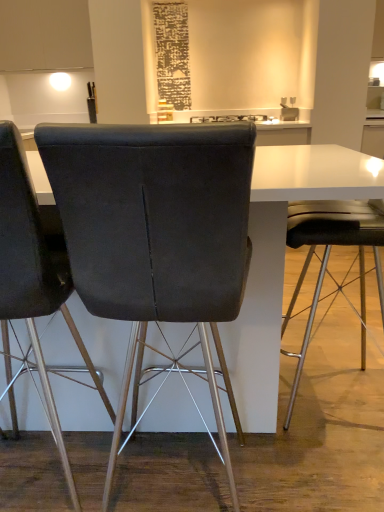
In order to face black glossy toaster at center, should I rotate leftwards or rightwards?

Turn right approximately 4.908 degrees to face it.

Identify the location of black glossy toaster at center. (233, 118).

This screenshot has height=512, width=384. Describe the element at coordinates (155, 230) in the screenshot. I see `dark gray fabric chair at center, which ranks as the 2th chair in left-to-right order` at that location.

Describe the element at coordinates (328, 258) in the screenshot. I see `matte black chair at right, positioned as the third chair in left-to-right order` at that location.

This screenshot has width=384, height=512. What are the coordinates of `matte white sink at upper center` in the screenshot? It's located at (289, 110).

Are dark gray fabric chair at center, which is the 2th chair in right-to-left order, and matte white sink at upper center located far from each other?

Yes, dark gray fabric chair at center, which is the 2th chair in right-to-left order, and matte white sink at upper center are quite far apart.

From the image's perspective, count 2nd chairs downward from the matte white sink at upper center and point to it. Please provide its 2D coordinates.

[(155, 230)]

Between dark gray fabric chair at center, which is the 2th chair in right-to-left order, and matte white sink at upper center, which one appears on the right side from the viewer's perspective?

Positioned to the right is matte white sink at upper center.

Looking at this image, is dark gray fabric chair at center, which is the 2th chair in right-to-left order, far away from velvet dark gray chair at left, acting as the 3th chair starting from the right?

No, dark gray fabric chair at center, which is the 2th chair in right-to-left order, is not far away from velvet dark gray chair at left, acting as the 3th chair starting from the right.

From a real-world perspective, does dark gray fabric chair at center, which is the 2th chair in right-to-left order, sit lower than velvet dark gray chair at left, the first chair positioned from the left?

Actually, dark gray fabric chair at center, which is the 2th chair in right-to-left order, is physically above velvet dark gray chair at left, the first chair positioned from the left, in the real world.

Considering the relative sizes of dark gray fabric chair at center, which ranks as the 2th chair in left-to-right order, and velvet dark gray chair at left, acting as the 3th chair starting from the right, in the image provided, is dark gray fabric chair at center, which ranks as the 2th chair in left-to-right order, shorter than velvet dark gray chair at left, acting as the 3th chair starting from the right,?

Correct, dark gray fabric chair at center, which ranks as the 2th chair in left-to-right order, is not as tall as velvet dark gray chair at left, acting as the 3th chair starting from the right.

Where is `chair located in front of the velvet dark gray chair at left, the first chair positioned from the left`? The height and width of the screenshot is (512, 384). chair located in front of the velvet dark gray chair at left, the first chair positioned from the left is located at coordinates (155, 230).

Is dark gray fabric chair at center, which is the 2th chair in right-to-left order, turned away from black glossy toaster at center?

No, dark gray fabric chair at center, which is the 2th chair in right-to-left order,'s orientation is not away from black glossy toaster at center.

Is point (200, 296) behind point (260, 116)?

No.

From the image's perspective, is dark gray fabric chair at center, which ranks as the 2th chair in left-to-right order, beneath black glossy toaster at center?

Yes, from the image's perspective, dark gray fabric chair at center, which ranks as the 2th chair in left-to-right order, is beneath black glossy toaster at center.

Does velvet dark gray chair at left, acting as the 3th chair starting from the right, appear on the left side of dark gray fabric chair at center, which ranks as the 2th chair in left-to-right order?

Correct, you'll find velvet dark gray chair at left, acting as the 3th chair starting from the right, to the left of dark gray fabric chair at center, which ranks as the 2th chair in left-to-right order.

Is velvet dark gray chair at left, the first chair positioned from the left, facing towards dark gray fabric chair at center, which ranks as the 2th chair in left-to-right order?

No, velvet dark gray chair at left, the first chair positioned from the left, is not turned towards dark gray fabric chair at center, which ranks as the 2th chair in left-to-right order.

From the image's perspective, is velvet dark gray chair at left, acting as the 3th chair starting from the right, beneath dark gray fabric chair at center, which is the 2th chair in right-to-left order?

Indeed, from the image's perspective, velvet dark gray chair at left, acting as the 3th chair starting from the right, is shown beneath dark gray fabric chair at center, which is the 2th chair in right-to-left order.

How many degrees apart are the facing directions of velvet dark gray chair at left, the first chair positioned from the left, and dark gray fabric chair at center, which ranks as the 2th chair in left-to-right order?

They differ by 0.364 degrees in their facing directions.

Between matte white sink at upper center and dark gray fabric chair at center, which ranks as the 2th chair in left-to-right order, which one has smaller size?

With smaller size is matte white sink at upper center.

Between matte white sink at upper center and dark gray fabric chair at center, which is the 2th chair in right-to-left order, which one has less height?

matte white sink at upper center.

In terms of width, does matte white sink at upper center look wider or thinner when compared to dark gray fabric chair at center, which ranks as the 2th chair in left-to-right order?

Clearly, matte white sink at upper center has less width compared to dark gray fabric chair at center, which ranks as the 2th chair in left-to-right order.

Is matte white sink at upper center to the right of matte black chair at right, positioned as the third chair in left-to-right order, from the viewer's perspective?

Yes, matte white sink at upper center is to the right of matte black chair at right, positioned as the third chair in left-to-right order.

From the image's perspective, is matte white sink at upper center under matte black chair at right, positioned as the third chair in left-to-right order?

Incorrect, from the image's perspective, matte white sink at upper center is higher than matte black chair at right, positioned as the third chair in left-to-right order.

From a real-world perspective, which object stands above the other?

matte white sink at upper center.

This screenshot has width=384, height=512. Identify the location of sink to the right of velvet dark gray chair at left, the first chair positioned from the left. (289, 110).

Does matte white sink at upper center contain velvet dark gray chair at left, the first chair positioned from the left?

No.

From the image's perspective, which one is positioned lower, matte white sink at upper center or velvet dark gray chair at left, the first chair positioned from the left?

velvet dark gray chair at left, the first chair positioned from the left, appears lower in the image.

From the image's perspective, which chair is the 2nd one below the matte white sink at upper center? Please provide its 2D coordinates.

[(155, 230)]

Where is `chair in front of the velvet dark gray chair at left, the first chair positioned from the left`? The width and height of the screenshot is (384, 512). chair in front of the velvet dark gray chair at left, the first chair positioned from the left is located at coordinates (155, 230).

From the picture: Looking at the image, which one is located closer to velvet dark gray chair at left, the first chair positioned from the left, black glossy toaster at center or dark gray fabric chair at center, which ranks as the 2th chair in left-to-right order?

dark gray fabric chair at center, which ranks as the 2th chair in left-to-right order, lies closer to velvet dark gray chair at left, the first chair positioned from the left, than the other object.

From the picture: Looking at the image, which one is located further to matte white sink at upper center, matte black chair at right, positioned as the third chair in left-to-right order, or dark gray fabric chair at center, which is the 2th chair in right-to-left order?

Among the two, dark gray fabric chair at center, which is the 2th chair in right-to-left order, is located further to matte white sink at upper center.

From the image, which object appears to be nearer to black glossy toaster at center, dark gray fabric chair at center, which ranks as the 2th chair in left-to-right order, or velvet dark gray chair at left, the first chair positioned from the left?

velvet dark gray chair at left, the first chair positioned from the left, is positioned closer to the anchor black glossy toaster at center.

Which object lies nearer to the anchor point velvet dark gray chair at left, the first chair positioned from the left, matte black chair at right, positioned as the third chair in left-to-right order, or black glossy toaster at center?

matte black chair at right, positioned as the third chair in left-to-right order, lies closer to velvet dark gray chair at left, the first chair positioned from the left, than the other object.

Considering their positions, is black glossy toaster at center positioned further to dark gray fabric chair at center, which is the 2th chair in right-to-left order, than velvet dark gray chair at left, acting as the 3th chair starting from the right?

black glossy toaster at center.

Based on their spatial positions, is velvet dark gray chair at left, the first chair positioned from the left, or matte white sink at upper center further from dark gray fabric chair at center, which ranks as the 2th chair in left-to-right order?

matte white sink at upper center.

Looking at the image, which one is located closer to matte black chair at right, the 1th chair positioned from the right, matte white sink at upper center or velvet dark gray chair at left, acting as the 3th chair starting from the right?

Based on the image, velvet dark gray chair at left, acting as the 3th chair starting from the right, appears to be nearer to matte black chair at right, the 1th chair positioned from the right.

Looking at this image, which object lies further to the anchor point matte white sink at upper center, dark gray fabric chair at center, which is the 2th chair in right-to-left order, or black glossy toaster at center?

Based on the image, dark gray fabric chair at center, which is the 2th chair in right-to-left order, appears to be further to matte white sink at upper center.

Locate an element on the screen. Image resolution: width=384 pixels, height=512 pixels. appliance located between matte black chair at right, the 1th chair positioned from the right, and matte white sink at upper center in the depth direction is located at coordinates (233, 118).

The image size is (384, 512). In order to click on chair positioned between velvet dark gray chair at left, the first chair positioned from the left, and matte white sink at upper center from near to far in this screenshot , I will do `click(328, 258)`.

Where is `chair between velvet dark gray chair at left, acting as the 3th chair starting from the right, and matte black chair at right, the 1th chair positioned from the right`? chair between velvet dark gray chair at left, acting as the 3th chair starting from the right, and matte black chair at right, the 1th chair positioned from the right is located at coordinates (155, 230).

I want to click on appliance positioned between velvet dark gray chair at left, the first chair positioned from the left, and matte white sink at upper center from near to far, so coord(233,118).